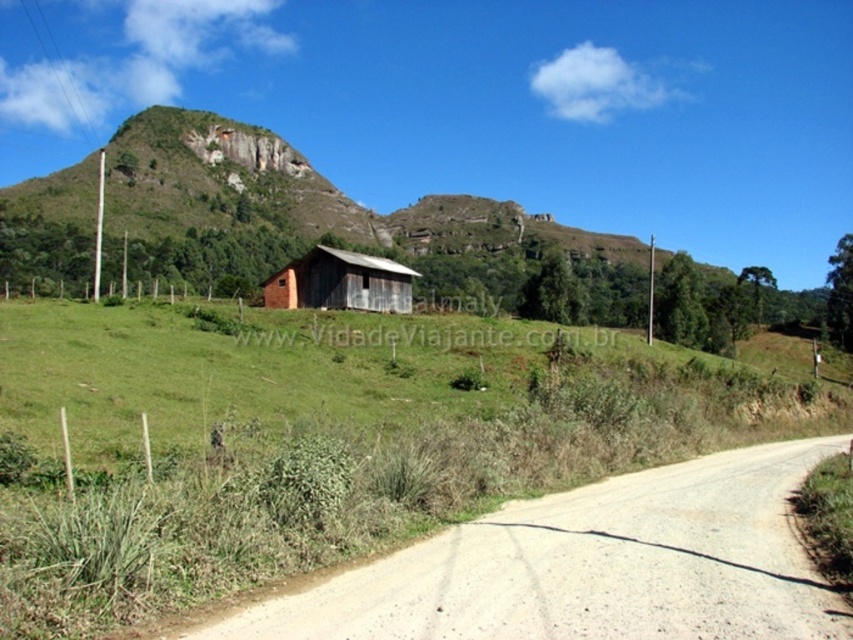
You are driving a car and want to park near the rustic wooden barn at center. The brown gravel road at lower left is the only path leading there. Is the road wide enough for your car to pass under the barn?

The brown gravel road at lower left is positioned under rustic wooden barn at center, so the road is not wide enough for the car to pass under the barn. You should choose a different route.